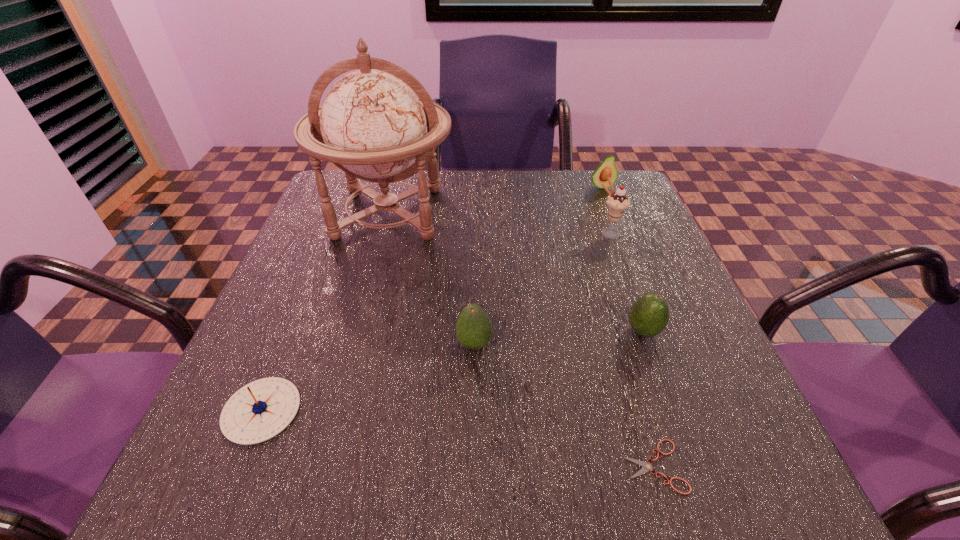
You are a GUI agent. You are given a task and a screenshot of the screen. Output one action in this format:
    pyautogui.click(x=<x>, y=<y>)
    Task: Click on the tallest object
    The image size is (960, 540).
    Given the screenshot: What is the action you would take?
    pyautogui.click(x=371, y=125)

Locate an element on the screen. The image size is (960, 540). icecream is located at coordinates (617, 202).

Locate an element on the screen. This screenshot has width=960, height=540. the farthest avocado is located at coordinates (607, 168).

Identify the location of the leftmost avocado. The image size is (960, 540). (474, 328).

This screenshot has width=960, height=540. I want to click on the second shortest object, so click(260, 410).

The height and width of the screenshot is (540, 960). Identify the location of the shortest object. (647, 467).

You are a GUI agent. You are given a task and a screenshot of the screen. Output one action in this format:
    pyautogui.click(x=<x>, y=<y>)
    Task: Click on the free space located 0.280m on the front-facing side of the tallest object
    The height and width of the screenshot is (540, 960).
    Given the screenshot: What is the action you would take?
    pyautogui.click(x=349, y=355)

At what (x,y) coordinates should I click in order to perform the action: click on free space located 0.340m on the left of the sixth shortest object. Please return your answer as a coordinate pair (x, y). This screenshot has height=540, width=960. Looking at the image, I should click on (451, 234).

This screenshot has width=960, height=540. I want to click on vacant space located on the cut side of the farthest avocado, so [x=623, y=240].

This screenshot has width=960, height=540. In order to click on vacant space located 0.310m on the right of the leftmost avocado in this screenshot , I will do `click(663, 345)`.